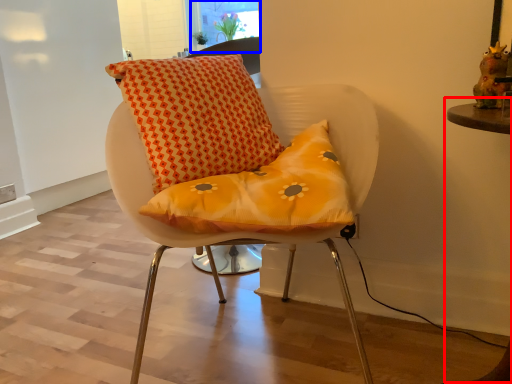
Question: Which object appears farthest to the camera in this image, table (highlighted by a red box) or window screen (highlighted by a blue box)?

Choices:
 (A) table
 (B) window screen

Answer: (B)